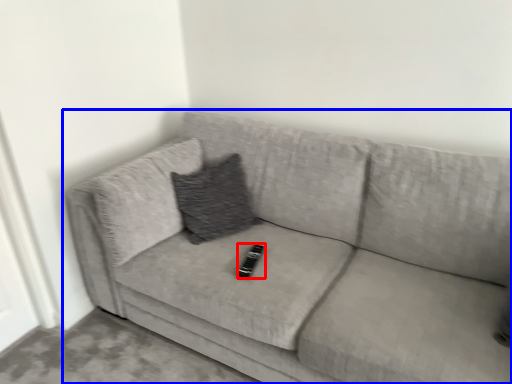
Question: Which point is further to the camera, remote (highlighted by a red box) or studio couch (highlighted by a blue box)?

Choices:
 (A) remote
 (B) studio couch

Answer: (A)